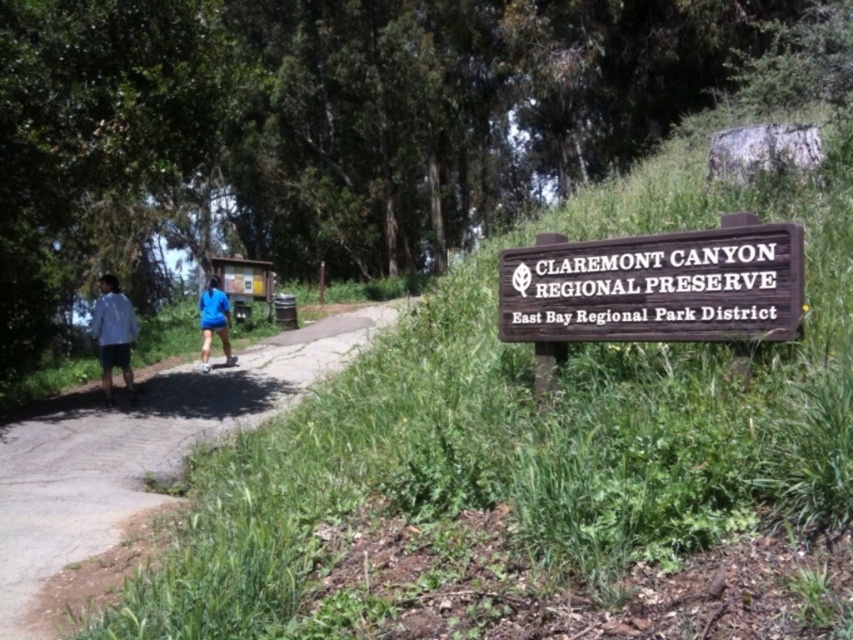
Question: Which is farther from the light blue shirt at left?

Choices:
 (A) blue fabric shorts at center
 (B) brown wooden sign at center
 (C) blue fabric jacket at left

Answer: (B)

Question: Which of the following is the closest to the observer?

Choices:
 (A) (618, 250)
 (B) (132, 456)
 (C) (207, 337)
 (D) (236, 356)

Answer: (A)

Question: Is light blue shirt at left bigger than blue fabric shorts at center?

Choices:
 (A) yes
 (B) no

Answer: (A)

Question: Which point appears farthest from the camera in this image?

Choices:
 (A) (213, 276)
 (B) (207, 314)

Answer: (A)

Question: Is gravel path at center smaller than blue fabric shorts at center?

Choices:
 (A) yes
 (B) no

Answer: (A)

Question: Is gravel path at center further to camera compared to brown wooden sign at center?

Choices:
 (A) no
 (B) yes

Answer: (B)